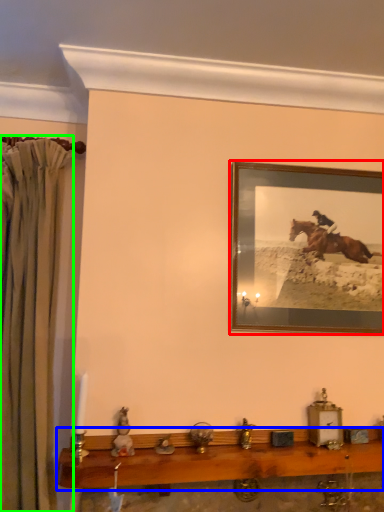
Question: Which object is positioned closest to picture frame (highlighted by a red box)? Select from table (highlighted by a blue box) and curtain (highlighted by a green box).

Choices:
 (A) table
 (B) curtain

Answer: (A)